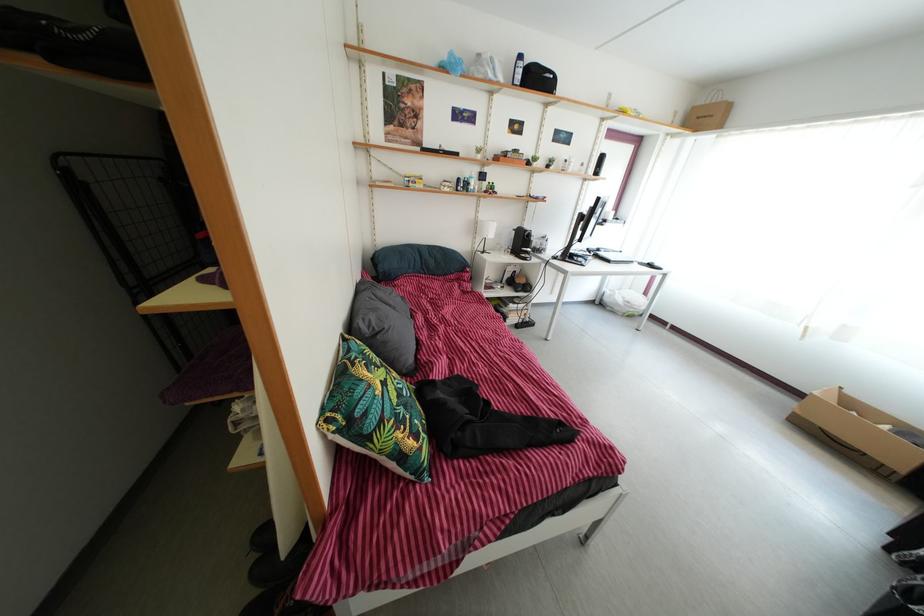
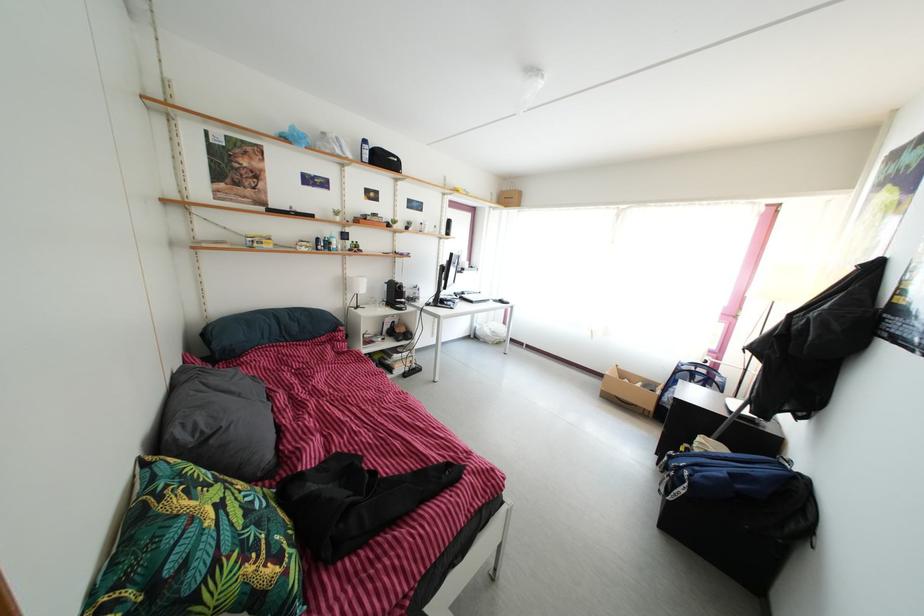
In the second image, find the point that corresponds to (x=524, y=290) in the first image.

(405, 339)